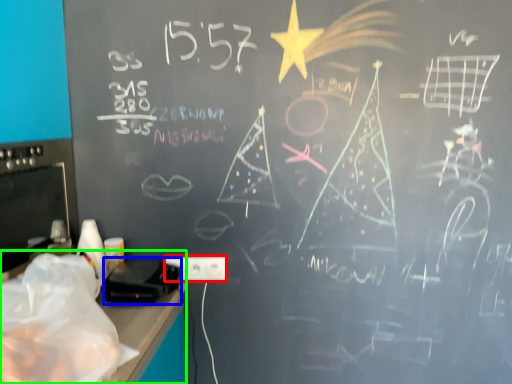
Question: Based on their relative distances, which object is farther from electric outlet (highlighted by a red box)? Choose from equipment (highlighted by a blue box) and computer desk (highlighted by a green box).

Choices:
 (A) equipment
 (B) computer desk

Answer: (B)